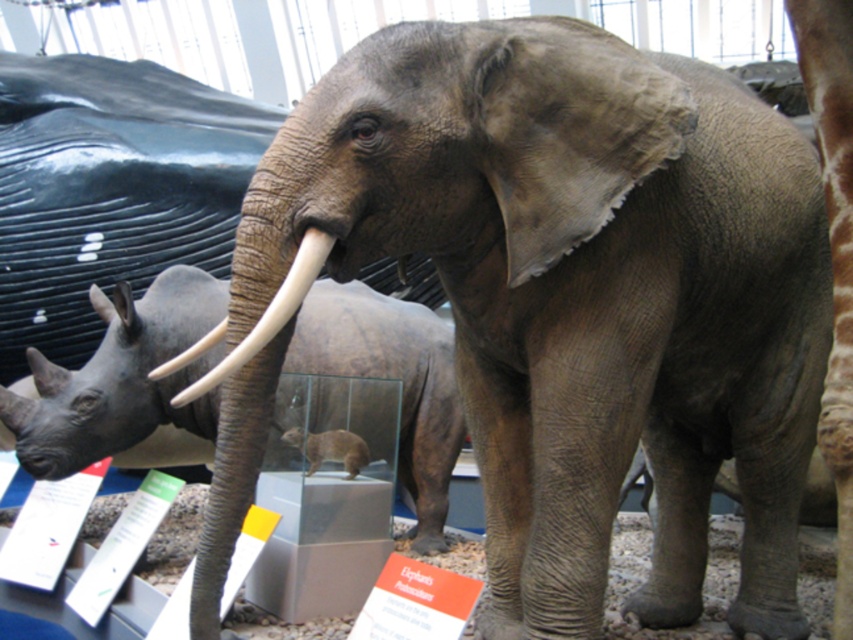
Can you confirm if matte gray rhinoceros at center is positioned to the right of white ivory tusk at center?

Correct, you'll find matte gray rhinoceros at center to the right of white ivory tusk at center.

Measure the distance between point (45, 444) and camera.

Point (45, 444) is 2.86 meters from camera.

At what (x,y) coordinates should I click in order to perform the action: click on matte gray rhinoceros at center. Please return your answer as a coordinate pair (x, y). The image size is (853, 640). Looking at the image, I should click on (120, 378).